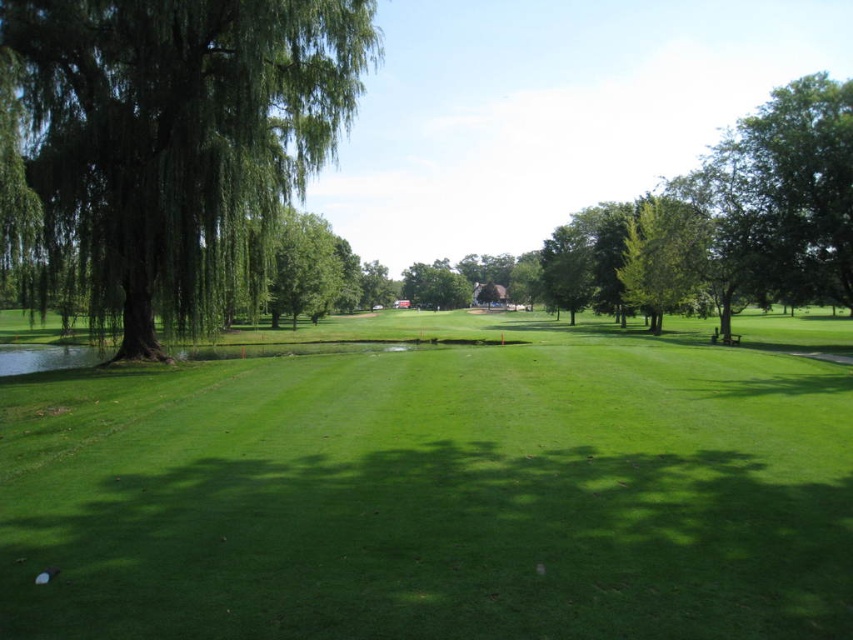
Is point (97, 232) less distant than point (698, 227)?

That is True.

Does green leafy tree at left have a greater width compared to green leafy tree at right?

Yes, green leafy tree at left is wider than green leafy tree at right.

Does point (180, 310) come farther from viewer compared to point (628, 260)?

No.

Locate an element on the screen. green leafy tree at left is located at coordinates [x=177, y=138].

Can you confirm if green grassy field at center is taller than green leafy tree at left?

In fact, green grassy field at center may be shorter than green leafy tree at left.

Is point (567, 332) farther from viewer compared to point (216, 99)?

That is True.

Describe the element at coordinates (433, 490) in the screenshot. The height and width of the screenshot is (640, 853). I see `green grassy field at center` at that location.

The width and height of the screenshot is (853, 640). What are the coordinates of `green grassy field at center` in the screenshot? It's located at click(433, 490).

Looking at this image, is green grassy field at center below green leafy tree at right?

Correct, green grassy field at center is located below green leafy tree at right.

Consider the image. Can you confirm if green grassy field at center is taller than green leafy tree at right?

No, green grassy field at center is not taller than green leafy tree at right.

Who is more distant from viewer, (706,612) or (654,252)?

The point (654,252) is behind.

Identify the location of green grassy field at center. [433, 490].